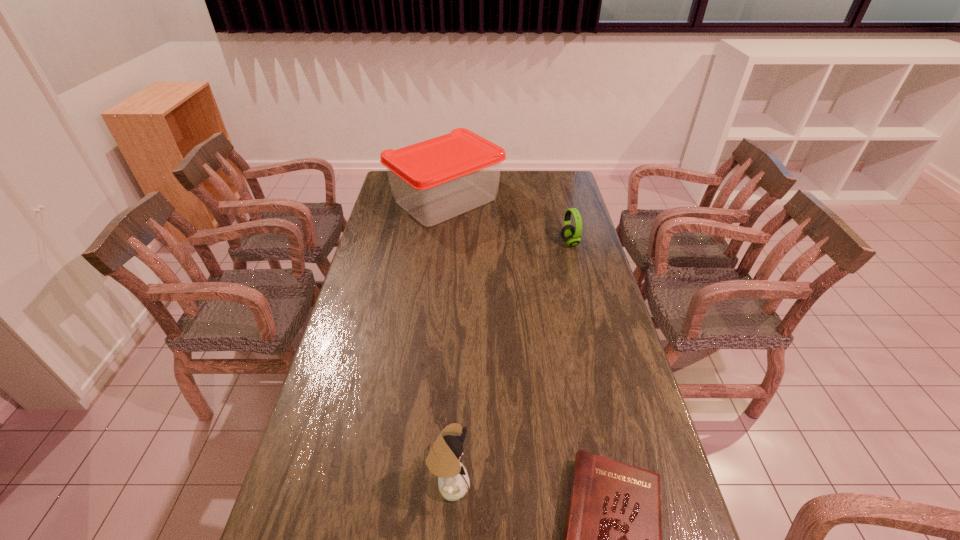
This screenshot has height=540, width=960. What are the coordinates of `free space that satisfies the following two spatial constraints: 1. on the front side of the tray; 2. on the left side of the second shortest object` in the screenshot? It's located at (442, 242).